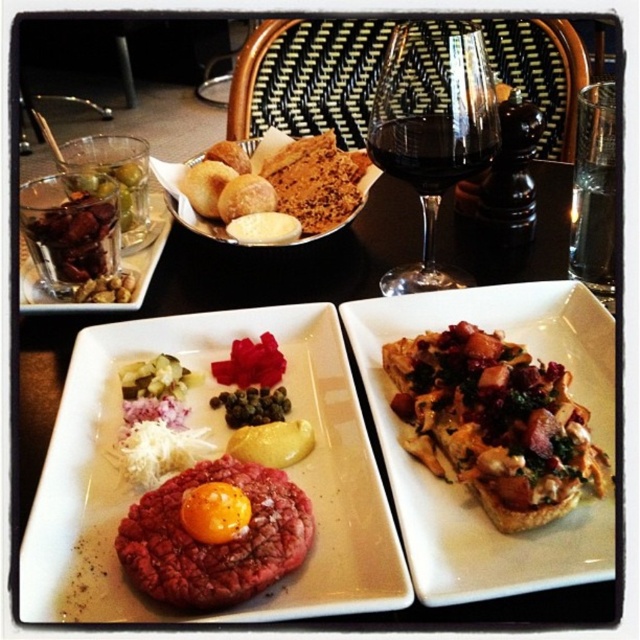
In the scene shown: You are a server who needs to determine which glass is shorter to place it in the dishwasher first. Based on the scene, which one between the transparent glass at upper center and the translucent glass with nuts at upper left is shorter?

The transparent glass at upper center has a lesser height compared to the translucent glass with nuts at upper left, so the transparent glass at upper center is shorter and should be placed in the dishwasher first.

You are a photographer holding a camera and want to capture a closeup of the point at coordinates (422, 525). Given that the camera requires a minimum distance of 10 inches to focus properly, will you be able to take a clear photo of that point?

The distance between the point at coordinates (422, 525) and the camera is 11.46 inches, which is greater than the minimum required distance of 10 inches. Therefore, you can take a clear photo of that point.